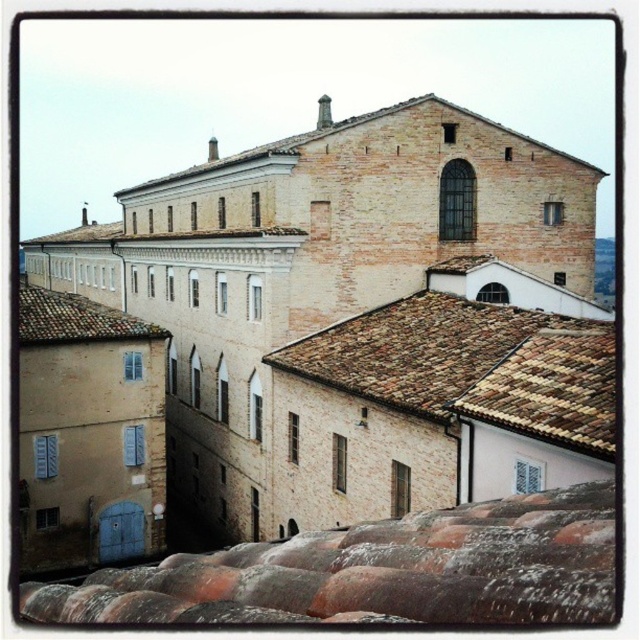
Between terracotta clay tiles at lower center and brown tiled roof at center, which one has less height?

With less height is terracotta clay tiles at lower center.

Which is more to the right, terracotta clay tiles at lower center or brown tiled roof at center?

brown tiled roof at center is more to the right.

Locate an element on the screen. terracotta clay tiles at lower center is located at coordinates (378, 572).

Locate an element on the screen. The image size is (640, 640). terracotta clay tiles at lower center is located at coordinates (378, 572).

Who is positioned more to the left, beige brick church at center or terracotta clay tiles at lower center?

From the viewer's perspective, beige brick church at center appears more on the left side.

Measure the distance between beige brick church at center and terracotta clay tiles at lower center.

They are 28.83 meters apart.

This screenshot has height=640, width=640. In order to click on beige brick church at center in this screenshot , I will do `click(360, 316)`.

You are a GUI agent. You are given a task and a screenshot of the screen. Output one action in this format:
    pyautogui.click(x=<x>, y=<y>)
    Task: Click on the beige brick church at center
    The height and width of the screenshot is (640, 640).
    Given the screenshot: What is the action you would take?
    pyautogui.click(x=360, y=316)

Where is `brown tile roof at left`? This screenshot has width=640, height=640. brown tile roof at left is located at coordinates (76, 317).